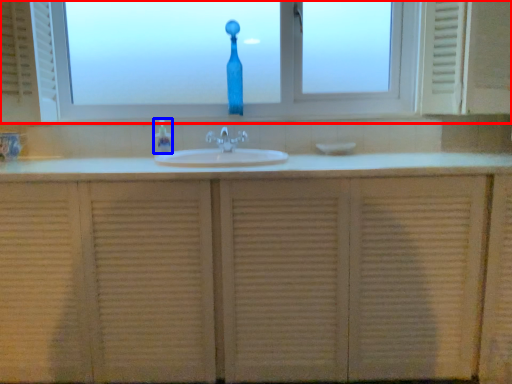
Question: Which point is closer to the camera, window (highlighted by a red box) or soap dispenser (highlighted by a blue box)?

Choices:
 (A) window
 (B) soap dispenser

Answer: (B)